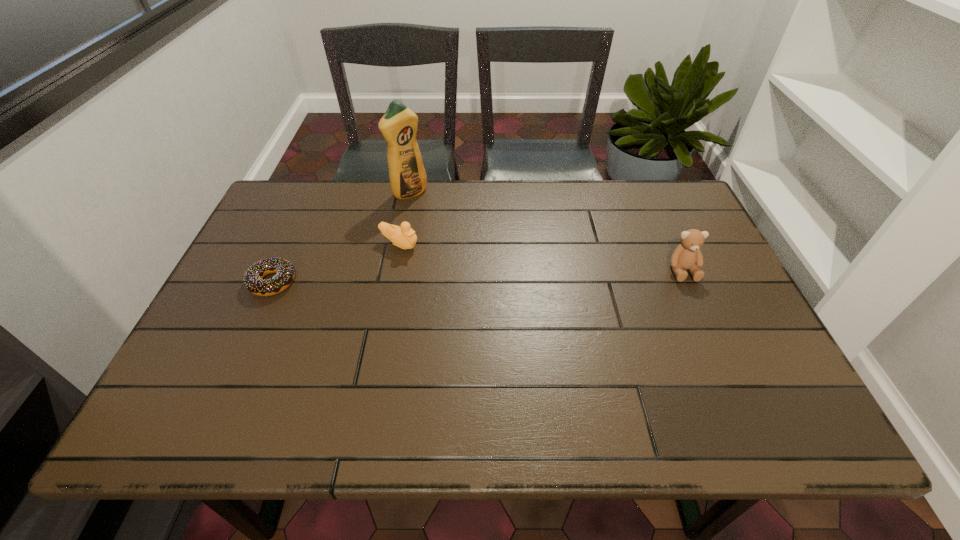
Locate an element on the screen. unoccupied area between the second tallest object and the farthest object is located at coordinates (546, 232).

Locate an element on the screen. The image size is (960, 540). unoccupied position between the third shortest object and the tallest object is located at coordinates (546, 232).

What are the coordinates of `vacant region between the doughnut and the duckling` in the screenshot? It's located at (336, 264).

Find the location of a particular element. empty location between the rightmost object and the duckling is located at coordinates (540, 258).

The width and height of the screenshot is (960, 540). I want to click on free space between the farthest object and the third nearest object, so click(x=404, y=219).

Where is `unoccupied position between the tallest object and the teddy bear`? unoccupied position between the tallest object and the teddy bear is located at coordinates (546, 232).

Locate which object ranks second in proximity to the teddy bear. Please provide its 2D coordinates. Your answer should be formatted as a tuple, i.e. [(x, y)], where the tuple contains the x and y coordinates of a point satisfying the conditions above.

[(399, 124)]

Locate an element on the screen. object that ranks as the second closest to the duckling is located at coordinates (253, 279).

The height and width of the screenshot is (540, 960). Find the location of `free space that satisfies the following two spatial constraints: 1. on the back side of the duckling; 2. on the left side of the farthest object`. free space that satisfies the following two spatial constraints: 1. on the back side of the duckling; 2. on the left side of the farthest object is located at coordinates (409, 193).